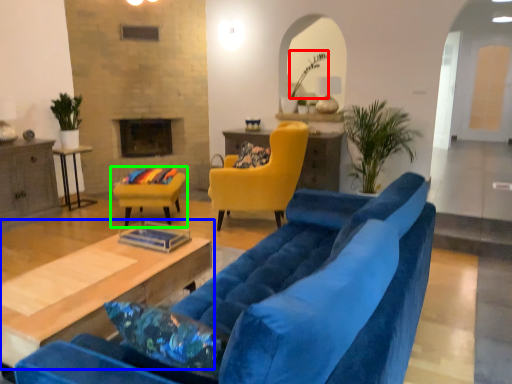
Question: Considering the real-world distances, which object is farthest from plant (highlighted by a red box)? table (highlighted by a blue box) or chair (highlighted by a green box)?

Choices:
 (A) table
 (B) chair

Answer: (A)